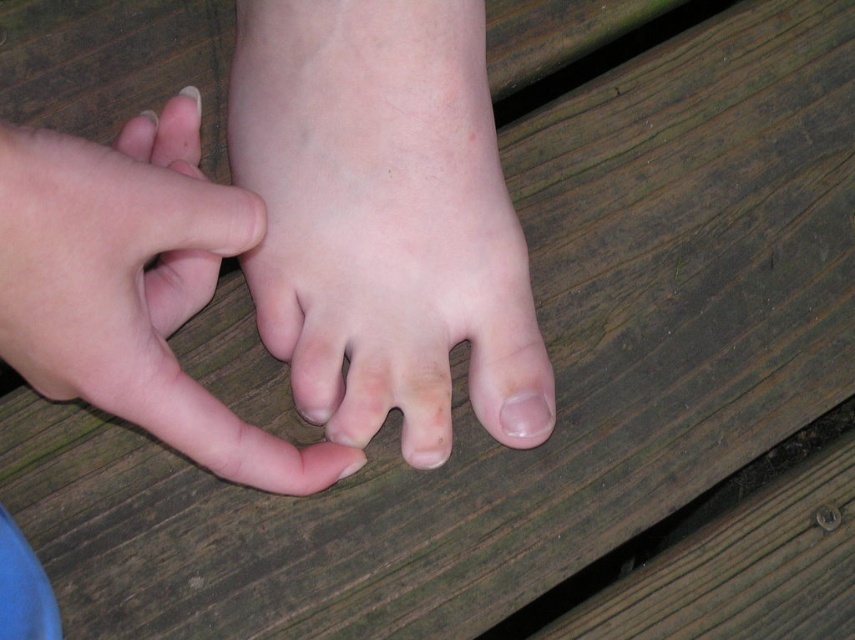
You are a photographer setting up a shoot on a wooden deck. You need to position a pale skin foot at center and a smooth pink nail at center so that the foot is visible in the photo. According to the scene description, how should you arrange them?

The pale skin foot at center should be placed in front of the smooth pink nail at center to ensure the foot is visible in the photo.